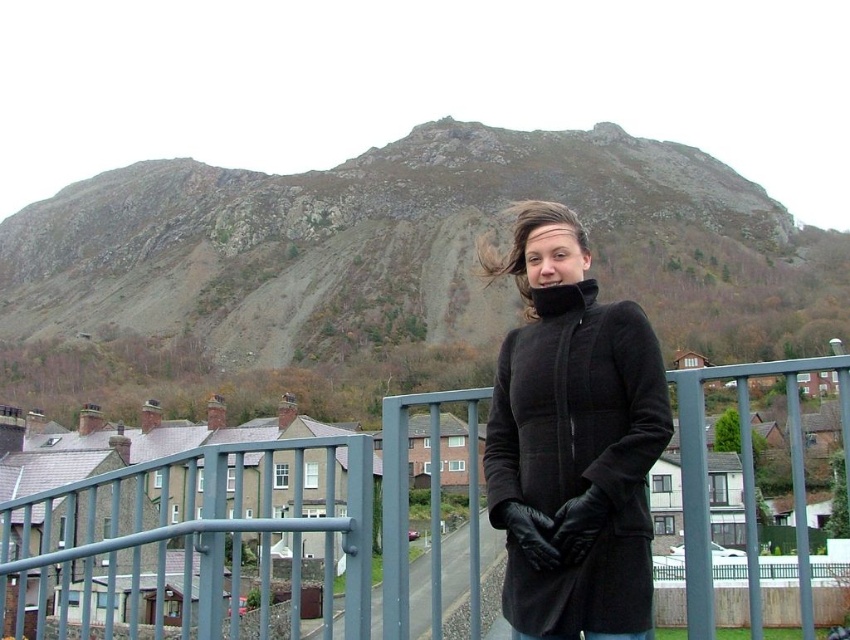
Between point (292, 316) and point (615, 435), which one is positioned behind?

The point (292, 316) is behind.

I want to click on rough stone mountain at upper center, so click(x=384, y=269).

Between rough stone mountain at upper center and metallic gray fence at center, which one appears on the left side from the viewer's perspective?

rough stone mountain at upper center is more to the left.

Measure the distance from rough stone mountain at upper center to metallic gray fence at center.

166.55 meters

Does point (432, 220) come farther from viewer compared to point (293, 563)?

Yes, it is behind point (293, 563).

Find the location of a particular element. This screenshot has width=850, height=640. rough stone mountain at upper center is located at coordinates (384, 269).

Is black wool coat at center to the left of metallic gray fence at center from the viewer's perspective?

Correct, you'll find black wool coat at center to the left of metallic gray fence at center.

Is black wool coat at center below metallic gray fence at center?

No, black wool coat at center is not below metallic gray fence at center.

What do you see at coordinates (571, 440) in the screenshot?
I see `black wool coat at center` at bounding box center [571, 440].

Find the location of a particular element. The width and height of the screenshot is (850, 640). black wool coat at center is located at coordinates (571, 440).